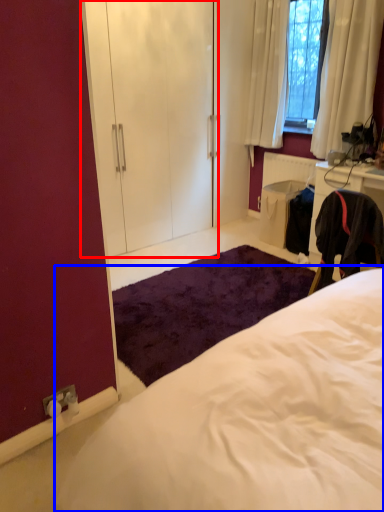
Question: Which point is closer to the camera, armoire (highlighted by a red box) or bed (highlighted by a blue box)?

Choices:
 (A) armoire
 (B) bed

Answer: (B)